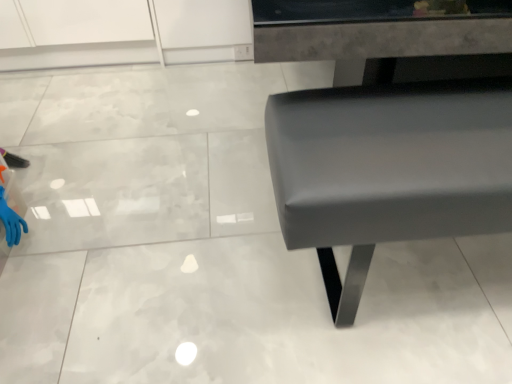
Question: In the image, is blue rubber glove at lower left positioned in front of or behind matte gray bench at center?

Choices:
 (A) front
 (B) behind

Answer: (B)

Question: Would you say blue rubber glove at lower left is to the left or to the right of matte gray bench at center in the picture?

Choices:
 (A) right
 (B) left

Answer: (B)

Question: In terms of height, does blue rubber glove at lower left look taller or shorter compared to matte gray bench at center?

Choices:
 (A) short
 (B) tall

Answer: (A)

Question: Which is correct: matte gray bench at center is inside blue rubber glove at lower left, or outside of it?

Choices:
 (A) outside
 (B) inside

Answer: (A)

Question: Is point (364, 127) positioned closer to the camera than point (16, 243)?

Choices:
 (A) farther
 (B) closer

Answer: (B)

Question: Is matte gray bench at center taller or shorter than blue rubber glove at lower left?

Choices:
 (A) tall
 (B) short

Answer: (A)

Question: In terms of width, does matte gray bench at center look wider or thinner when compared to blue rubber glove at lower left?

Choices:
 (A) wide
 (B) thin

Answer: (A)